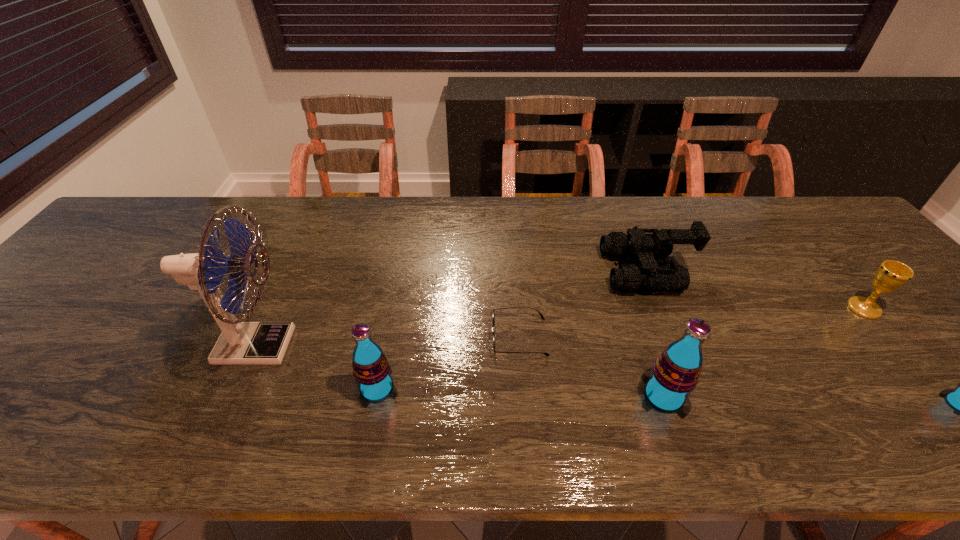
Where is `free space for a new soda on the left`? free space for a new soda on the left is located at coordinates (99, 381).